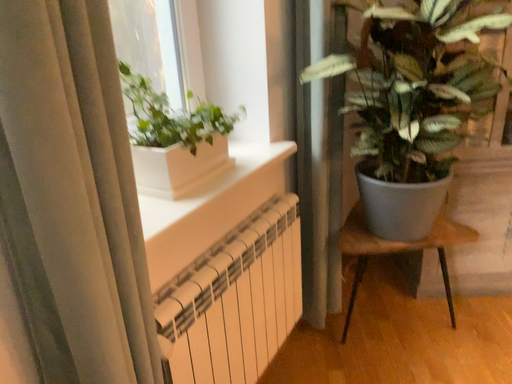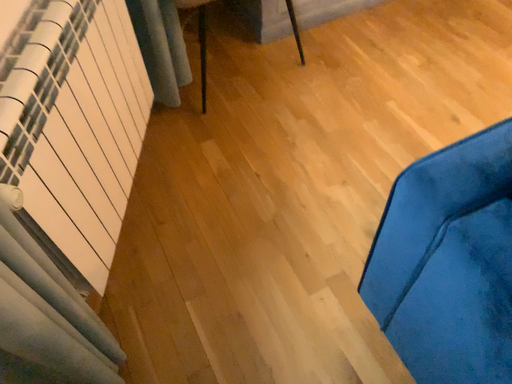
Question: How did the camera likely rotate when shooting the video?

Choices:
 (A) rotated left
 (B) rotated right

Answer: (B)